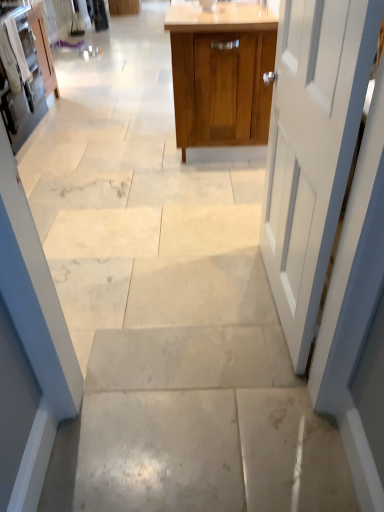
Image resolution: width=384 pixels, height=512 pixels. Identify the location of free location to the left of wooden cabinet at center, the third cabinetry positioned from the left. (110, 119).